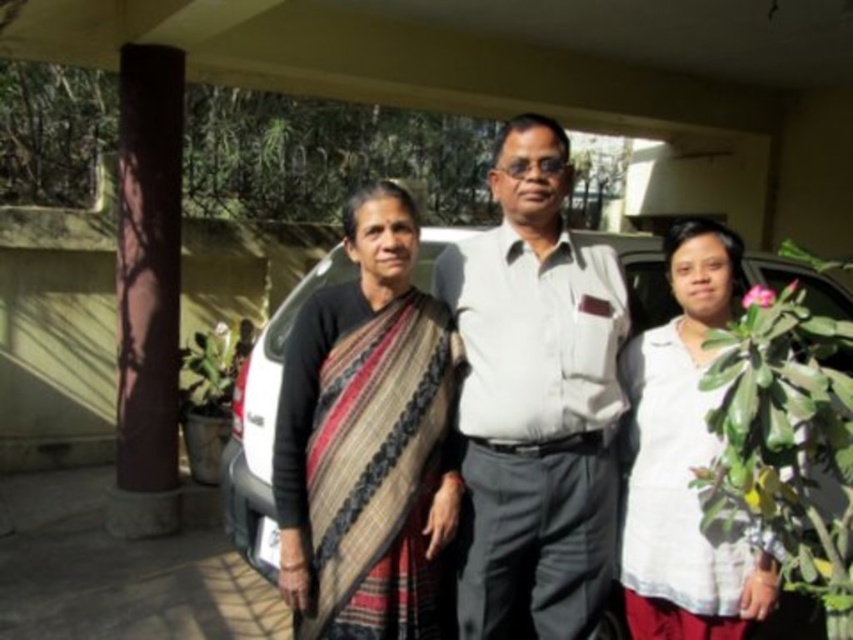
Question: Among these objects, which one is farthest from the camera?

Choices:
 (A) white smooth shirt at center
 (B) white cotton shirt at center

Answer: (A)

Question: Which of the following is the closest to the observer?

Choices:
 (A) (427, 336)
 (B) (281, 332)
 (C) (608, 584)
 (D) (674, 232)

Answer: (A)

Question: Can you confirm if white smooth shirt at center is positioned to the left of white matte car at center?

Choices:
 (A) yes
 (B) no

Answer: (B)

Question: Among these objects, which one is nearest to the camera?

Choices:
 (A) white smooth shirt at center
 (B) striped fabric saree at center
 (C) white cotton shirt at center

Answer: (B)

Question: Can you confirm if white smooth shirt at center is positioned below white cotton shirt at center?

Choices:
 (A) yes
 (B) no

Answer: (B)

Question: Can you confirm if striped fabric saree at center is bigger than white cotton shirt at center?

Choices:
 (A) yes
 (B) no

Answer: (A)